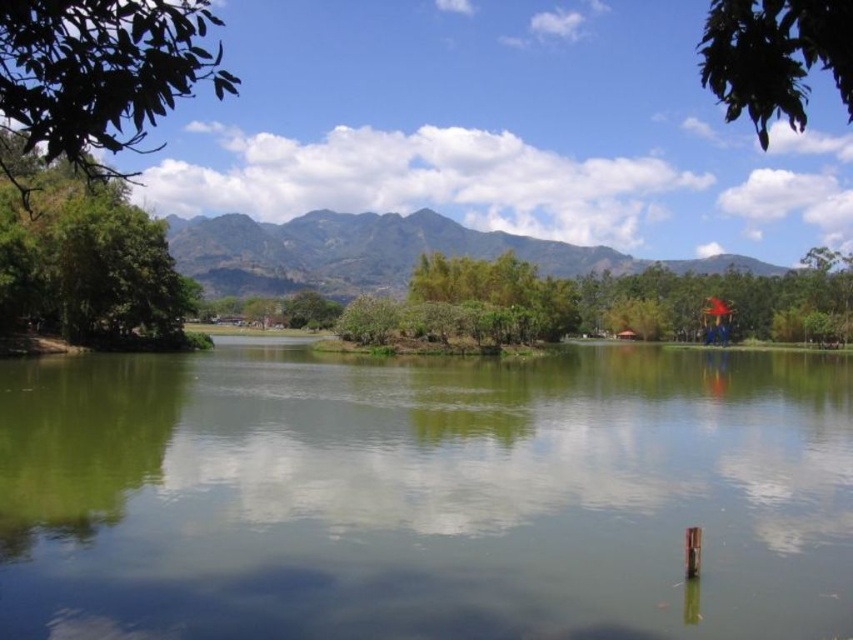
The height and width of the screenshot is (640, 853). What do you see at coordinates (102, 74) in the screenshot?
I see `green leafy tree at upper left` at bounding box center [102, 74].

Can you confirm if green leafy tree at upper left is positioned to the right of green textured mountain at upper center?

No, green leafy tree at upper left is not to the right of green textured mountain at upper center.

Identify the location of green leafy tree at upper left. The height and width of the screenshot is (640, 853). (102, 74).

Can you confirm if green leafy tree at upper left is bigger than green leafy tree at left?

Yes.

Find the location of a particular element. This screenshot has width=853, height=640. green leafy tree at upper left is located at coordinates pos(102,74).

The width and height of the screenshot is (853, 640). What do you see at coordinates (102, 74) in the screenshot? I see `green leafy tree at upper left` at bounding box center [102, 74].

Between point (90, 148) and point (792, 106), which one is positioned in front?

Point (792, 106) is more forward.

Describe the element at coordinates (102, 74) in the screenshot. I see `green leafy tree at upper left` at that location.

This screenshot has width=853, height=640. I want to click on green leafy tree at upper left, so click(102, 74).